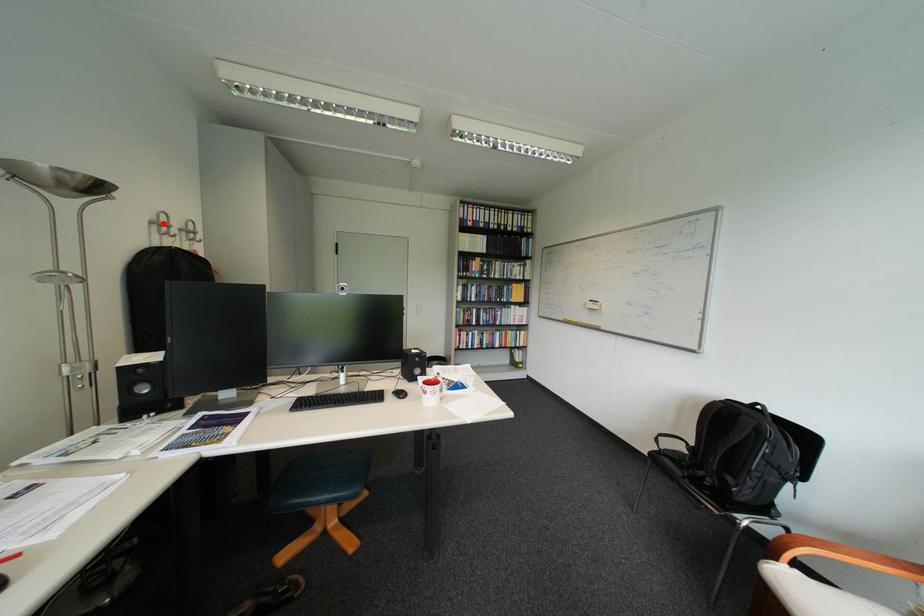
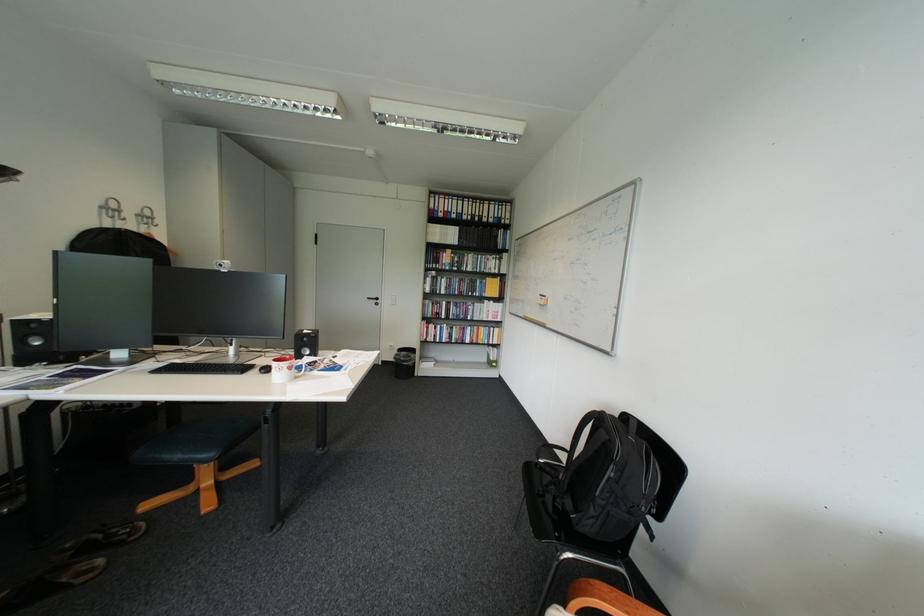
In the second image, find the point that corresponds to the highlighted location in the first image.

(114, 208)